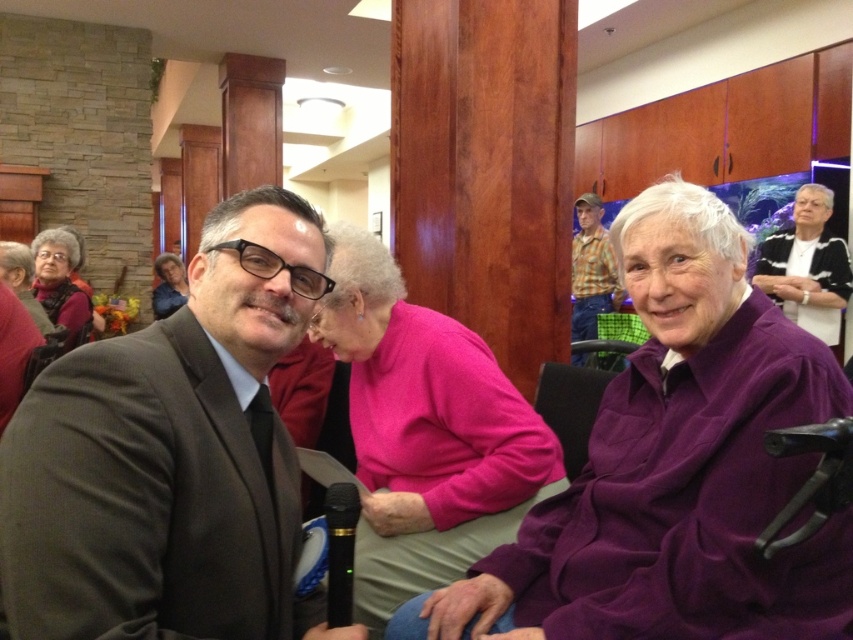
Based on the photo, is purple fleece jacket at center smaller than matte black sweater at upper left?

Yes, purple fleece jacket at center is smaller than matte black sweater at upper left.

The width and height of the screenshot is (853, 640). What do you see at coordinates (674, 467) in the screenshot?
I see `purple fleece jacket at center` at bounding box center [674, 467].

Identify the location of purple fleece jacket at center. (674, 467).

Between matte black sweater at upper left and matte pink sweater at center, which one is positioned lower?

Positioned lower is matte black sweater at upper left.

Is matte black sweater at upper left taller than matte pink sweater at center?

Yes, matte black sweater at upper left is taller than matte pink sweater at center.

The image size is (853, 640). I want to click on matte black sweater at upper left, so click(x=62, y=284).

Is the position of dark brown suit at center less distant than that of matte pink sweater at center?

That is True.

Can you confirm if dark brown suit at center is thinner than matte pink sweater at center?

Yes.

The width and height of the screenshot is (853, 640). Identify the location of dark brown suit at center. (171, 454).